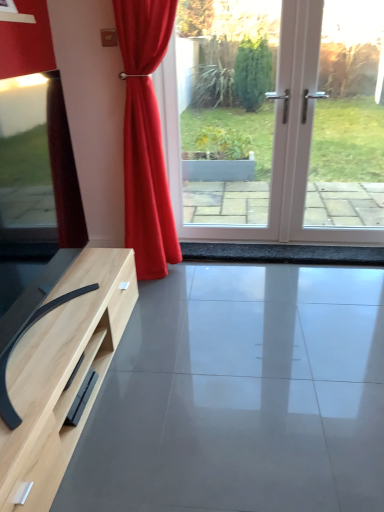
You are a GUI agent. You are given a task and a screenshot of the screen. Output one action in this format:
    pyautogui.click(x=<x>, y=<y>)
    Task: Click on the free space below satin red curtain at center (from a real-world perspective)
    The height and width of the screenshot is (512, 384).
    Given the screenshot: What is the action you would take?
    pyautogui.click(x=182, y=270)